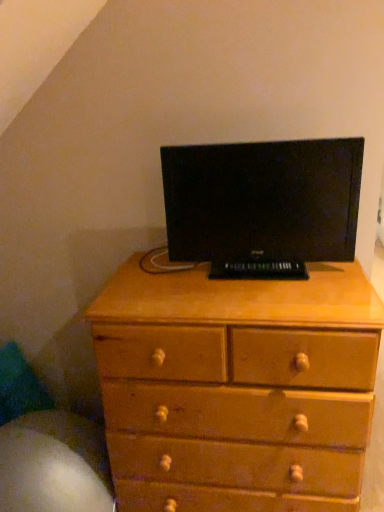
This screenshot has height=512, width=384. Find the location of `free space in front of black matte computer monitor at center`. free space in front of black matte computer monitor at center is located at coordinates (269, 298).